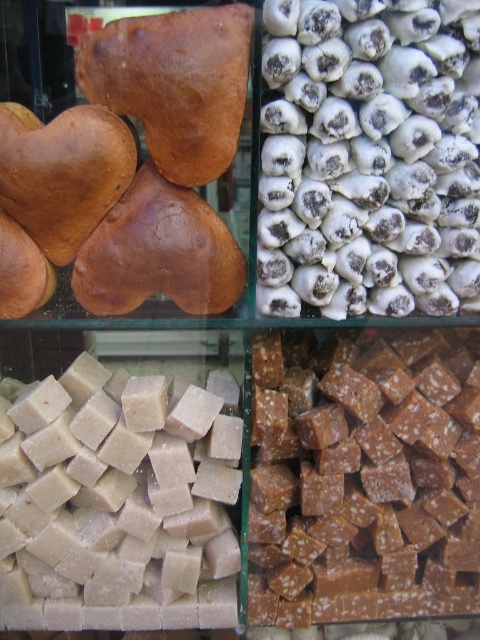
You are a customer at a bakery and want to buy a white sugared candy at upper right and a caramelized sugar cubes at center. Which of these two items is larger in size?

The caramelized sugar cubes at center are larger than the white sugared candy at upper right.